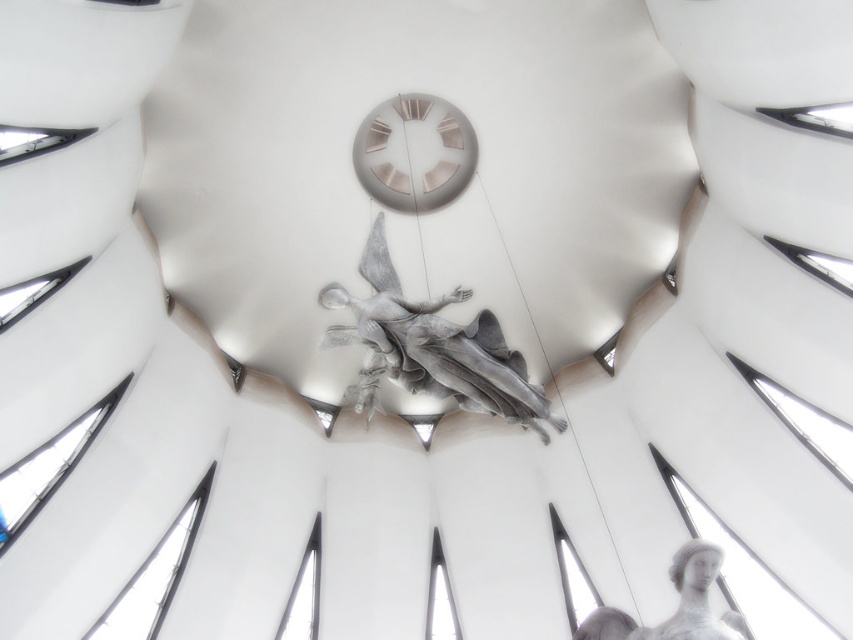
Is sculpted silver angel at center above metallic silver clock at center?

No.

Is sculpted silver angel at center in front of metallic silver clock at center?

Yes, it is in front of metallic silver clock at center.

Describe the element at coordinates (431, 348) in the screenshot. I see `sculpted silver angel at center` at that location.

This screenshot has width=853, height=640. What are the coordinates of `sculpted silver angel at center` in the screenshot? It's located at (431, 348).

Does metallic silver clock at center appear on the right side of gray stone statue at lower right?

No, metallic silver clock at center is not to the right of gray stone statue at lower right.

What are the coordinates of `metallic silver clock at center` in the screenshot? It's located at (x=415, y=152).

Which is in front, point (430, 202) or point (704, 573)?

Point (704, 573) is in front.

At what (x,y) coordinates should I click in order to perform the action: click on metallic silver clock at center. Please return your answer as a coordinate pair (x, y). The width and height of the screenshot is (853, 640). Looking at the image, I should click on (415, 152).

Is sculpted silver angel at center positioned at the back of gray stone statue at lower right?

That is True.

Which is in front, point (373, 252) or point (630, 634)?

Point (630, 634) is more forward.

Where is `sculpted silver angel at center`? sculpted silver angel at center is located at coordinates (431, 348).